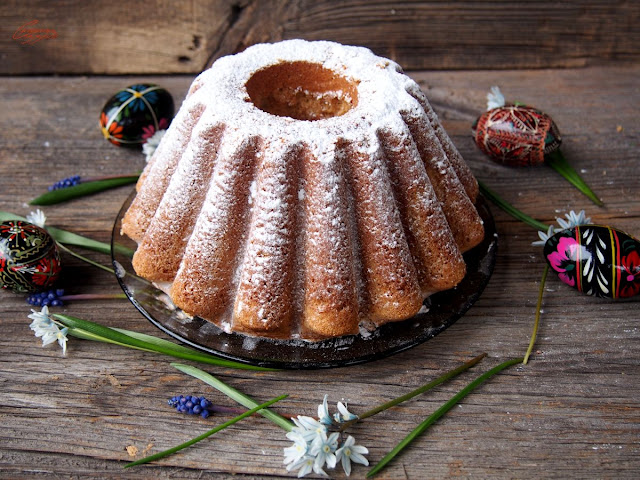
The image size is (640, 480). What are the coordinates of `knot in wood` in the screenshot? It's located at (236, 15).